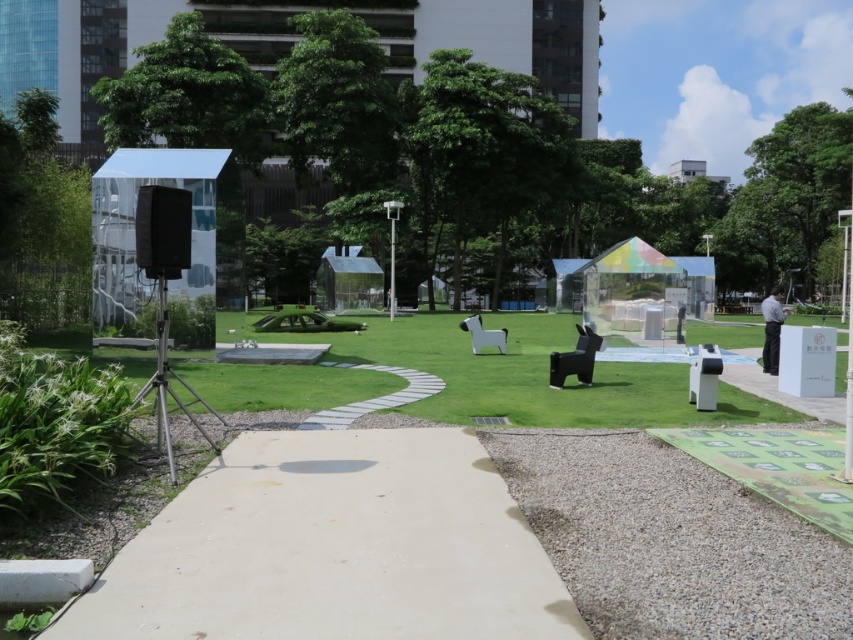
You are a park visitor who wants to sit on the black matte bench at center. Can you walk directly to it from the beige concrete path at center without stepping on any grass?

The beige concrete path at center is positioned under the black matte bench at center, so you can walk directly to it from the beige concrete path at center without stepping on any grass.

You are a park visitor who wants to sit on the white plastic bench at center. From your current position on the gray concrete path at center, which direction should you move to reach the bench?

The gray concrete path at center is positioned on the left side of the white plastic bench at center, so you should move to the right to reach the bench.